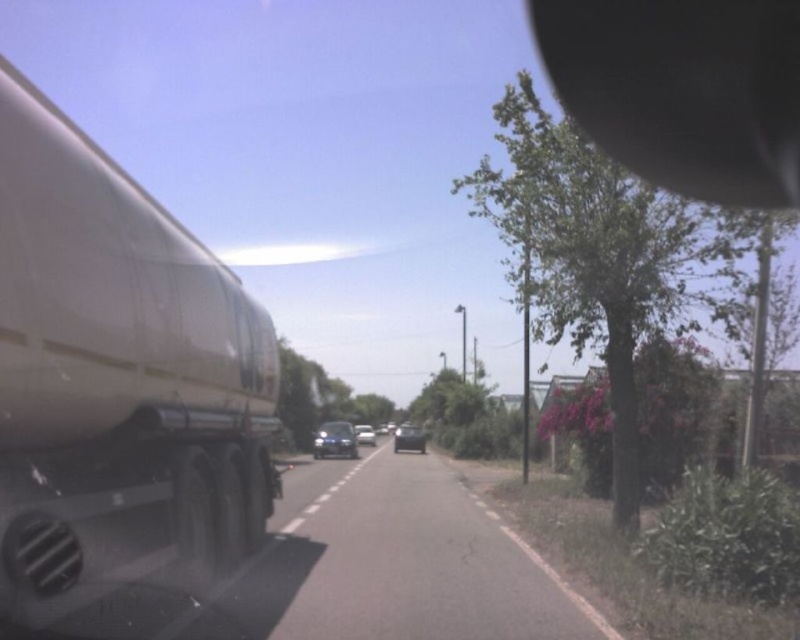
Question: Estimate the real-world distances between objects in this image. Which object is closer to the shiny silver sedan at center?

Choices:
 (A) black rubber view mirror at upper right
 (B) black asphalt road at center
 (C) matte white trailer truck at left
 (D) shiny black sedan at center

Answer: (D)

Question: Which point is closer to the camera?

Choices:
 (A) (320, 445)
 (B) (394, 445)

Answer: (A)

Question: Among these points, which one is nearest to the camera?

Choices:
 (A) (556, 589)
 (B) (416, 436)
 (C) (22, 547)

Answer: (C)

Question: Does shiny black sedan at center appear over shiny silver sedan at center?

Choices:
 (A) yes
 (B) no

Answer: (A)

Question: From the image, what is the correct spatial relationship of shiny black sedan at center in relation to shiny silver sedan at center?

Choices:
 (A) right
 (B) left

Answer: (A)

Question: Can you confirm if black rubber view mirror at upper right is positioned above shiny blue sedan at center?

Choices:
 (A) yes
 (B) no

Answer: (A)